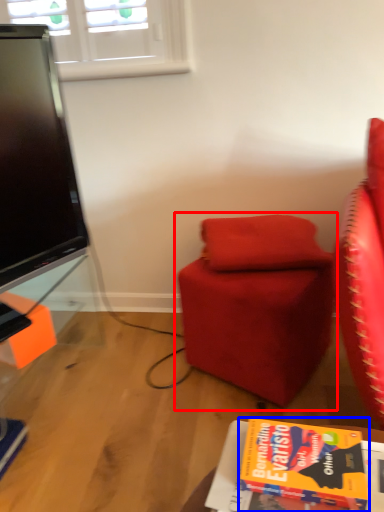
Question: Which of the following is the closest to the observer, chair (highlighted by a red box) or book (highlighted by a blue box)?

Choices:
 (A) chair
 (B) book

Answer: (B)